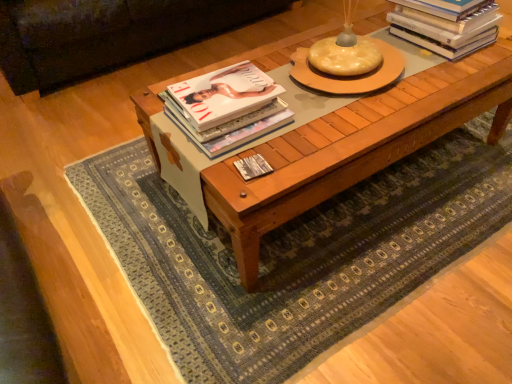
This screenshot has width=512, height=384. In order to click on free spot above woven rug at center (from a real-world perspective) in this screenshot , I will do `click(337, 215)`.